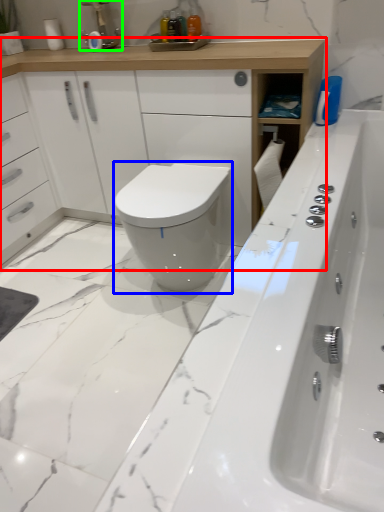
Question: Considering the real-world distances, which object is closest to bathroom cabinet (highlighted by a red box)? bidet (highlighted by a blue box) or faucet (highlighted by a green box).

Choices:
 (A) bidet
 (B) faucet

Answer: (B)